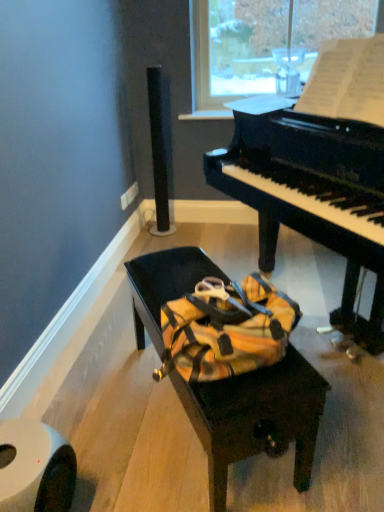
Looking at this image, what is the approximate width of black glossy piano at center?

It is 4.83 feet.

What do you see at coordinates (312, 194) in the screenshot? I see `black glossy piano at center` at bounding box center [312, 194].

What do you see at coordinates (256, 418) in the screenshot? The width and height of the screenshot is (384, 512). I see `matte black bench at center` at bounding box center [256, 418].

Locate an element on the screen. black glossy piano at center is located at coordinates (312, 194).

Can you see black glossy piano at center touching matte black bench at center?

No, black glossy piano at center is not making contact with matte black bench at center.

Considering the sizes of black glossy piano at center and matte black bench at center in the image, is black glossy piano at center taller or shorter than matte black bench at center?

black glossy piano at center is taller than matte black bench at center.

Consider the image. From the image's perspective, between black glossy piano at center and matte black bench at center, which one is located above?

black glossy piano at center appears higher in the image.

Which is farther, (28,465) or (248,204)?

The point (248,204) is more distant.

Looking at this image, is white matte toilet paper at lower left inside the boundaries of black glossy piano at center, or outside?

white matte toilet paper at lower left is not inside black glossy piano at center, it's outside.

From a real-world perspective, relative to black glossy piano at center, is white matte toilet paper at lower left vertically above or below?

From a real-world perspective, white matte toilet paper at lower left is physically below black glossy piano at center.

From the image's perspective, would you say white matte toilet paper at lower left is shown under black glossy piano at center?

Indeed, from the image's perspective, white matte toilet paper at lower left is shown beneath black glossy piano at center.

Considering the positions of points (146, 288) and (256, 129), is point (146, 288) farther from camera compared to point (256, 129)?

No, (146, 288) is closer to viewer.

Is matte black bench at center thinner than black glossy piano at center?

Correct, the width of matte black bench at center is less than that of black glossy piano at center.

Would you consider matte black bench at center to be distant from black glossy piano at center?

No, matte black bench at center is not far from black glossy piano at center.

Does matte black bench at center appear on the left side of black glossy piano at center?

Yes, matte black bench at center is to the left of black glossy piano at center.

From a real-world perspective, is black glossy piano at center physically located above or below white matte toilet paper at lower left?

From a real-world perspective, black glossy piano at center is physically above white matte toilet paper at lower left.

Looking at this image, how different are the orientations of black glossy piano at center and white matte toilet paper at lower left in degrees?

The facing directions of black glossy piano at center and white matte toilet paper at lower left are 146 degrees apart.

Does point (243, 122) lie behind point (54, 445)?

That is True.

Is black glossy piano at center not inside white matte toilet paper at lower left?

black glossy piano at center is positioned outside white matte toilet paper at lower left.

From the image's perspective, would you say white matte toilet paper at lower left is positioned over matte black bench at center?

No, from the image's perspective, white matte toilet paper at lower left is not over matte black bench at center.

Is there a large distance between white matte toilet paper at lower left and matte black bench at center?

No, white matte toilet paper at lower left is in close proximity to matte black bench at center.

Would you say white matte toilet paper at lower left is outside matte black bench at center?

white matte toilet paper at lower left lies outside matte black bench at center's area.

Choose the correct answer: Is matte black bench at center inside white matte toilet paper at lower left or outside it?

matte black bench at center is outside white matte toilet paper at lower left.

From a real-world perspective, who is located lower, matte black bench at center or white matte toilet paper at lower left?

From a 3D spatial view, white matte toilet paper at lower left is below.

Considering the sizes of objects matte black bench at center and white matte toilet paper at lower left in the image provided, who is thinner, matte black bench at center or white matte toilet paper at lower left?

→ Thinner between the two is white matte toilet paper at lower left.

Can you confirm if matte black bench at center is positioned to the left of white matte toilet paper at lower left?

No, matte black bench at center is not to the left of white matte toilet paper at lower left.

Find the location of a particular element. furniture behind the black glossy piano at center is located at coordinates (256, 418).

This screenshot has width=384, height=512. In order to click on piano on the right of white matte toilet paper at lower left in this screenshot , I will do `click(312, 194)`.

Based on their spatial positions, is matte black bench at center or white matte toilet paper at lower left closer to black glossy piano at center?

Based on the image, matte black bench at center appears to be nearer to black glossy piano at center.

From the image, which object appears to be farther from white matte toilet paper at lower left, black glossy piano at center or matte black bench at center?

black glossy piano at center.

Considering their positions, is matte black bench at center positioned closer to white matte toilet paper at lower left than black glossy piano at center?

Among the two, matte black bench at center is located nearer to white matte toilet paper at lower left.

Which object lies nearer to the anchor point matte black bench at center, black glossy piano at center or white matte toilet paper at lower left?

Among the two, white matte toilet paper at lower left is located nearer to matte black bench at center.

Based on their spatial positions, is white matte toilet paper at lower left or black glossy piano at center closer to matte black bench at center?

Among the two, white matte toilet paper at lower left is located nearer to matte black bench at center.

From the image, which object appears to be farther from black glossy piano at center, white matte toilet paper at lower left or matte black bench at center?

The object further to black glossy piano at center is white matte toilet paper at lower left.

Locate an element on the screen. furniture situated between white matte toilet paper at lower left and black glossy piano at center from left to right is located at coordinates (256, 418).